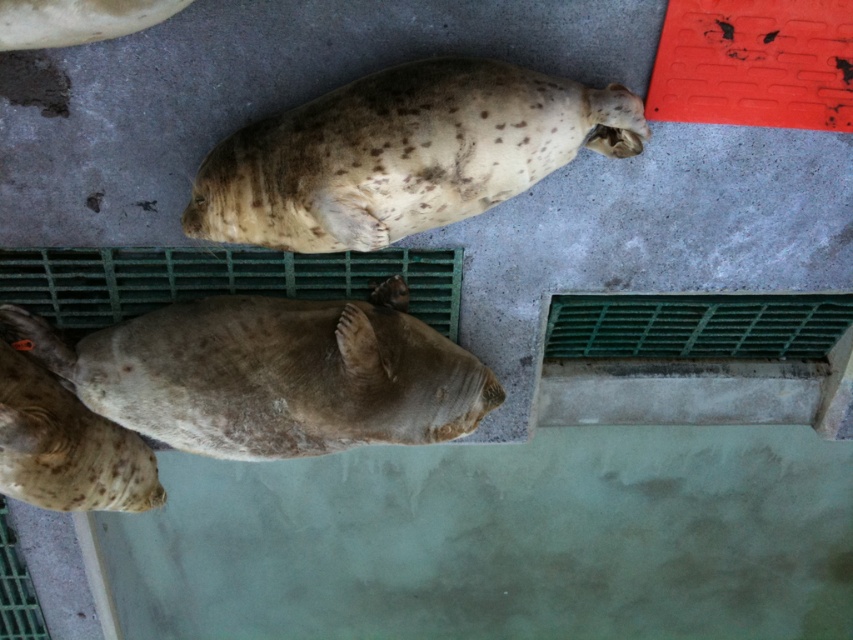
You are a zookeeper observing two seals in their enclosure. You notice the speckled fur seal at upper center and the speckled fur seal at lower left. Which seal has a larger body size based on their visible width?

The speckled fur seal at upper center has a larger body size because its width surpasses that of the speckled fur seal at lower left.

You are a zookeeper who needs to feed two seals. You have a bucket of fish. The speckled fur seal at center and the speckled fur seal at lower left are both waiting. Based on their sizes, which seal should you give more fish to?

The speckled fur seal at center is bigger than the speckled fur seal at lower left, so you should give more fish to the speckled fur seal at center.

You are standing at the camera position and want to place a small treat exactly at point (293, 352). If you throw the treat with a horizontal distance of 3 meters, will it land at the desired point?

The distance between the camera and point (293, 352) is 2.95 meters. Since you are throwing the treat 3 meters horizontally, it will land beyond the desired point by approximately 0.05 meters.